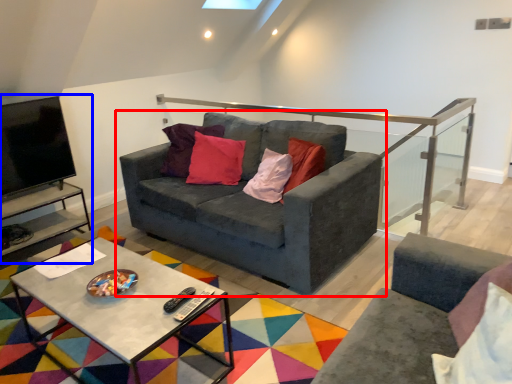
Question: Among these objects, which one is nearest to the camera, studio couch (highlighted by a red box) or entertainment center (highlighted by a blue box)?

Choices:
 (A) studio couch
 (B) entertainment center

Answer: (A)